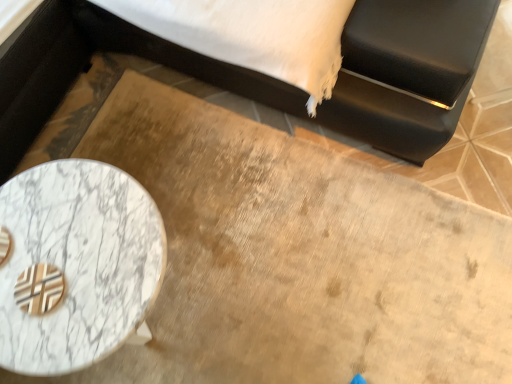
Question: Based on their positions, is marble table at lower left located to the left or right of black leather bed at upper left?

Choices:
 (A) left
 (B) right

Answer: (A)

Question: Is marble table at lower left spatially inside black leather bed at upper left, or outside of it?

Choices:
 (A) outside
 (B) inside

Answer: (A)

Question: Considering the positions of marble table at lower left and black leather bed at upper left in the image, is marble table at lower left taller or shorter than black leather bed at upper left?

Choices:
 (A) short
 (B) tall

Answer: (A)

Question: Is black leather bed at upper left wider or thinner than marble table at lower left?

Choices:
 (A) wide
 (B) thin

Answer: (A)

Question: Considering the positions of point 124,48 and point 110,344, is point 124,48 closer or farther from the camera than point 110,344?

Choices:
 (A) farther
 (B) closer

Answer: (A)

Question: Choose the correct answer: Is black leather bed at upper left inside marble table at lower left or outside it?

Choices:
 (A) outside
 (B) inside

Answer: (A)

Question: From the image's perspective, is black leather bed at upper left above or below marble table at lower left?

Choices:
 (A) below
 (B) above

Answer: (B)